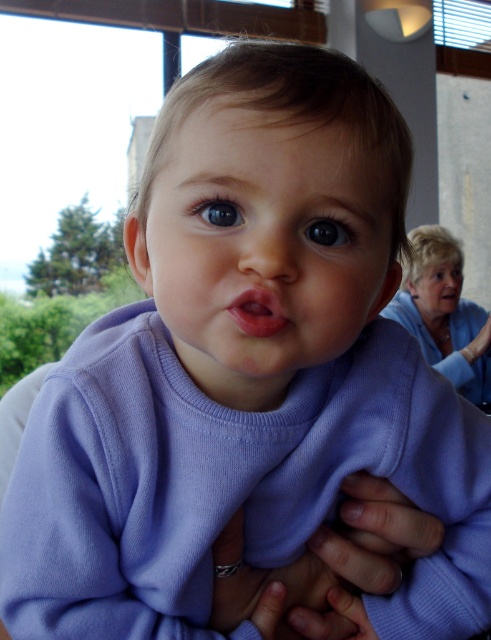
You are a photographer adjusting the lighting for a closeup shot of the purple soft fabric baby at center and the pink glossy lips at center. Since you want to ensure both are well lit, which object should you focus the light on first considering their size?

The purple soft fabric baby at center is larger in size than the pink glossy lips at center, so you should focus the light on the purple soft fabric baby at center first to ensure proper illumination.

You are a photographer holding a camera. You want to take a photo of the purple soft fabric baby at center from a distance that ensures the subject is in focus. The camera requires a minimum focus distance of 13 inches. Can you take the photo without moving closer?

The purple soft fabric baby at center and viewer are 12.99 inches apart. Since the minimum focus distance is 13 inches, the photographer cannot take the photo without moving closer because the current distance is slightly less than required.

You are a photographer who wants to ensure both the purple soft fabric baby at center and the smooth skin face at right are clearly visible in the photo. Given their sizes, which object should you focus on to capture both effectively?

Since the purple soft fabric baby at center is larger than the smooth skin face at right, you should focus on the purple soft fabric baby at center to ensure both are in focus as it takes up more space in the frame.